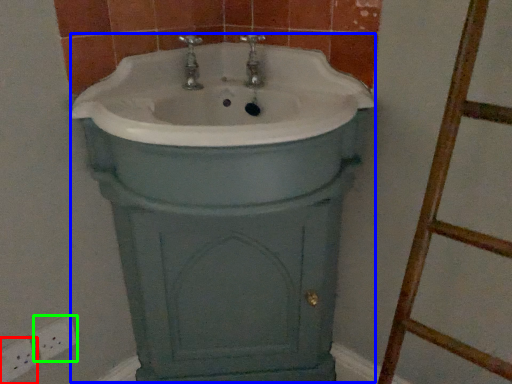
Question: Which is nearer to the electric outlet (highlighted by a red box)? porcelain (highlighted by a blue box) or electric outlet (highlighted by a green box).

Choices:
 (A) porcelain
 (B) electric outlet

Answer: (B)